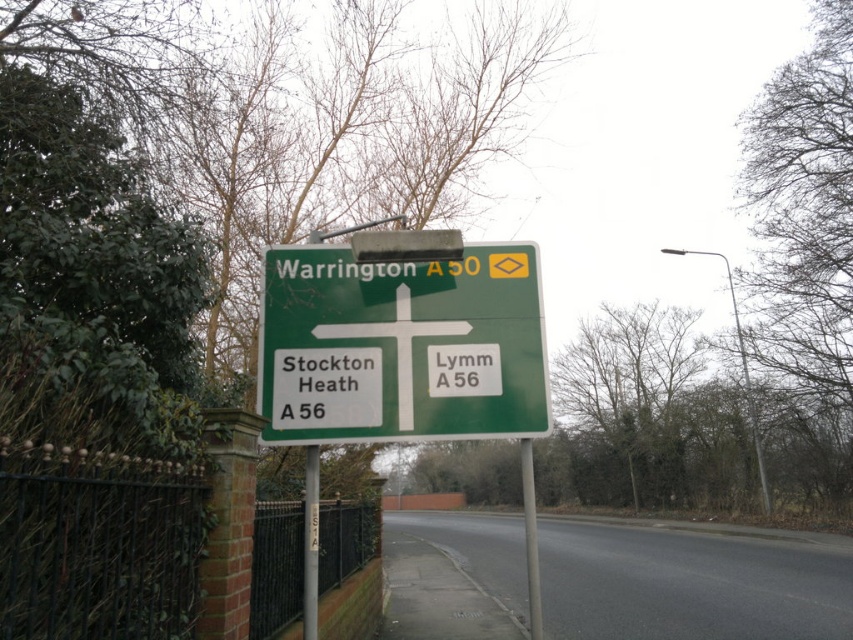
Question: Can you confirm if green matte sign at center is positioned to the right of gray metallic pole at center?

Choices:
 (A) no
 (B) yes

Answer: (A)

Question: Among these points, which one is nearest to the camera?

Choices:
 (A) (315, 304)
 (B) (537, 598)

Answer: (B)

Question: Which object is farther from the camera taking this photo?

Choices:
 (A) green plastic sign at center
 (B) gray metallic pole at center
 (C) green matte sign at center

Answer: (A)

Question: Which object appears farthest from the camera in this image?

Choices:
 (A) green plastic sign at center
 (B) gray metallic pole at center

Answer: (A)

Question: Does metallic pole at center have a greater width compared to gray metallic pole at center?

Choices:
 (A) no
 (B) yes

Answer: (A)

Question: Is green plastic sign at center above metallic pole at center?

Choices:
 (A) yes
 (B) no

Answer: (A)